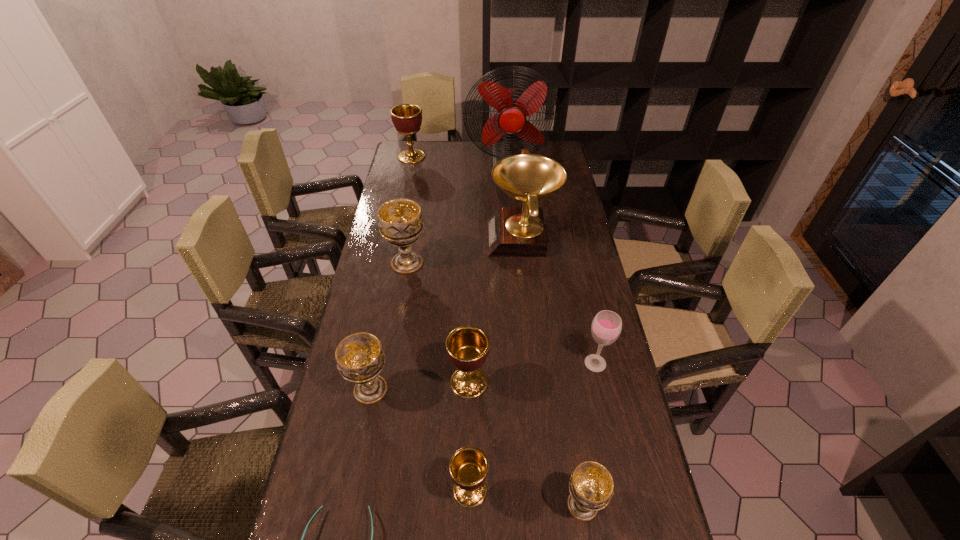
Where is `the tallest object`? The width and height of the screenshot is (960, 540). the tallest object is located at coordinates (513, 106).

The height and width of the screenshot is (540, 960). I want to click on award, so click(x=511, y=231).

Find the location of a particular element. The height and width of the screenshot is (540, 960). the farthest chalice is located at coordinates (407, 118).

Find the location of a particular element. The height and width of the screenshot is (540, 960). the leftmost golden chalice is located at coordinates click(x=407, y=118).

Image resolution: width=960 pixels, height=540 pixels. In order to click on the biggest white chalice in this screenshot , I will do `click(400, 221)`.

Identify the location of the fifth nearest chalice. This screenshot has height=540, width=960. (400, 221).

You are a GUI agent. You are given a task and a screenshot of the screen. Output one action in this format:
    pyautogui.click(x=<x>, y=<y>)
    Task: Click on the wineglass
    Image resolution: width=960 pixels, height=540 pixels.
    Given the screenshot: What is the action you would take?
    pyautogui.click(x=606, y=327)

Locate an element on the screen. the second biggest golden chalice is located at coordinates (467, 346).

Where is `the second farthest white chalice`? the second farthest white chalice is located at coordinates (360, 359).

Identify the location of the smallest golden chalice. The width and height of the screenshot is (960, 540). (468, 466).